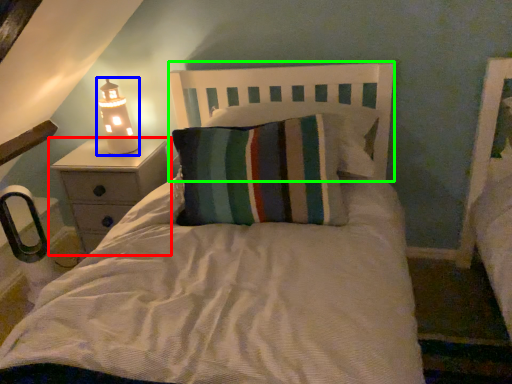
Question: Which is nearer to the nightstand (highlighted by a red box)? lamp (highlighted by a blue box) or headboard (highlighted by a green box).

Choices:
 (A) lamp
 (B) headboard

Answer: (A)